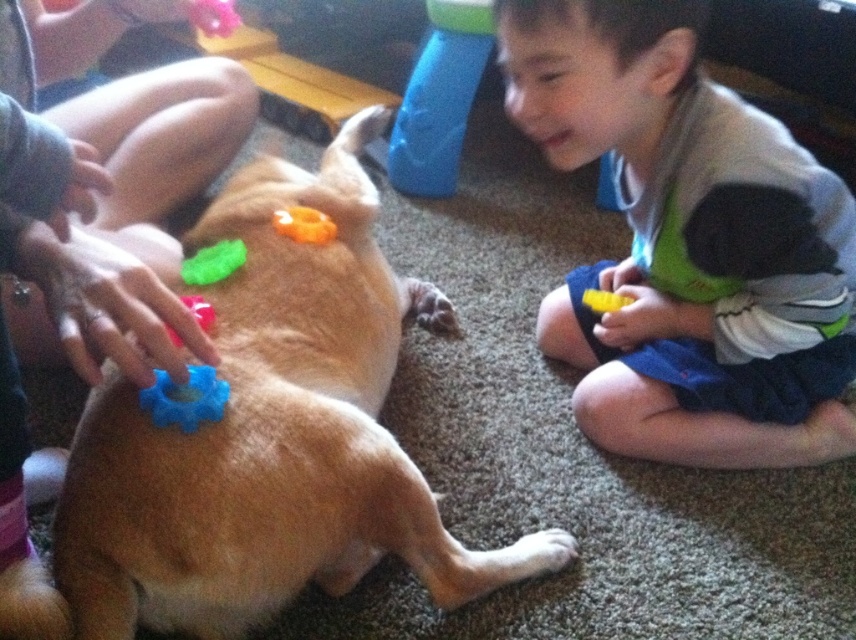
You are a photographer standing at the camera position. You want to take a photo of the scene. If you move forward by 0.5 meters, will the point at point (337, 184) become closer to the camera?

The distance of point (337, 184) from camera is 1.25 meters. If you move forward by 0.5 meters, the new distance would be 1.25 meters minus 0.5 meters, which is 0.75 meters. Therefore, the point at point (337, 184) will become closer to the camera.

You are a delivery robot that needs to place a small package between the brown matte dog at center and the green fabric shorts at lower right. Can you fit the package there if it measures 16 inches in length?

The distance between the brown matte dog at center and the green fabric shorts at lower right is 15.59 inches. Since the package is 16 inches long, it won answer the package cannot fit between them because the distance is slightly shorter than the package length. 15.59 inches is less than 16 inches, so the package won